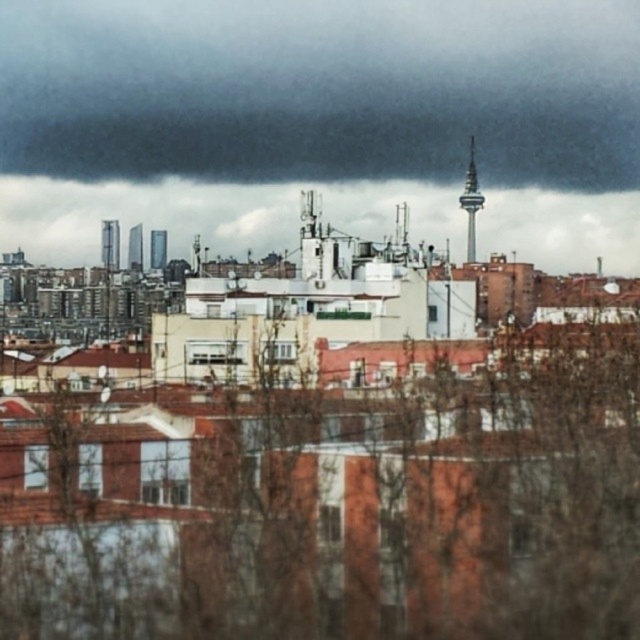
Does dark gray cloud at upper center have a greater width compared to cloudy sky at upper center?

Yes, dark gray cloud at upper center is wider than cloudy sky at upper center.

Is dark gray cloud at upper center to the right of cloudy sky at upper center from the viewer's perspective?

No, dark gray cloud at upper center is not to the right of cloudy sky at upper center.

Measure the distance between dark gray cloud at upper center and camera.

A distance of 659.07 meters exists between dark gray cloud at upper center and camera.

The height and width of the screenshot is (640, 640). Identify the location of dark gray cloud at upper center. (323, 90).